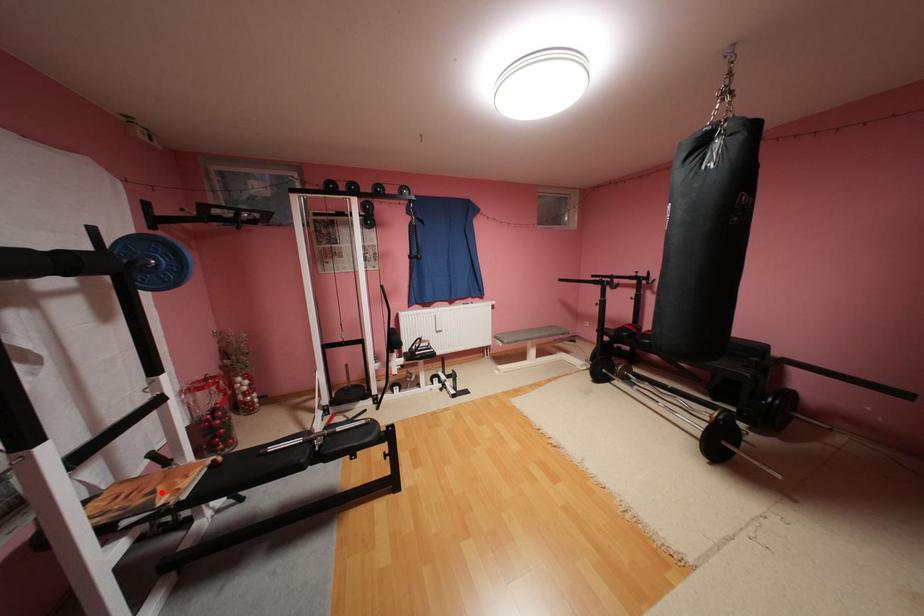
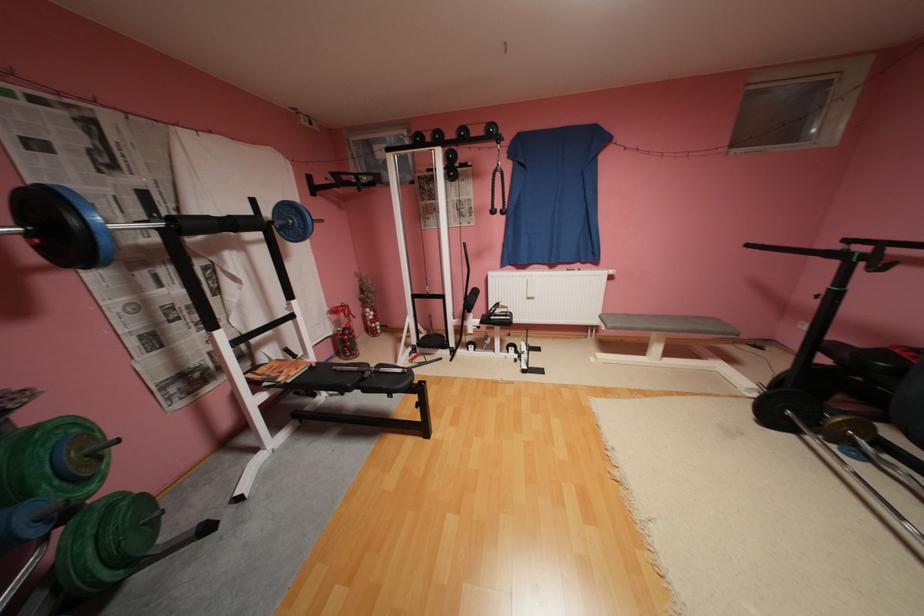
Where in the second image is the point corresponding to the highlighted location from the first image?

(290, 371)